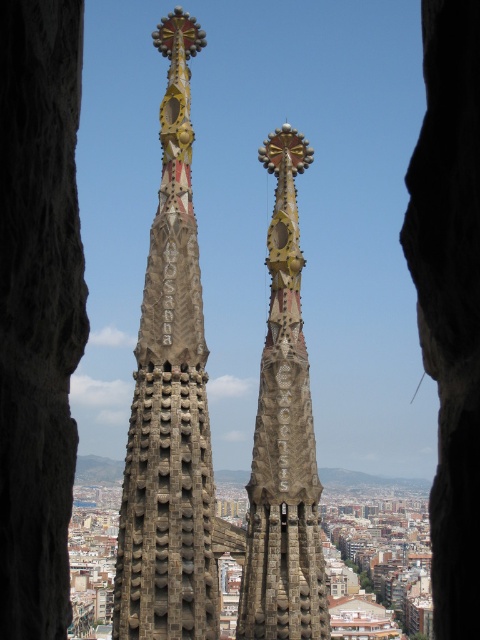
Question: Is rustic stone spire at center behind stone spire at center?

Choices:
 (A) no
 (B) yes

Answer: (A)

Question: Among these points, which one is farthest from the camera?

Choices:
 (A) (168, 481)
 (B) (291, 280)

Answer: (B)

Question: Is rustic stone spire at center further to camera compared to stone spire at center?

Choices:
 (A) no
 (B) yes

Answer: (A)

Question: Does rustic stone spire at center come behind stone spire at center?

Choices:
 (A) yes
 (B) no

Answer: (B)

Question: Which object appears closest to the camera in this image?

Choices:
 (A) rustic stone spire at center
 (B) stone spire at center

Answer: (A)